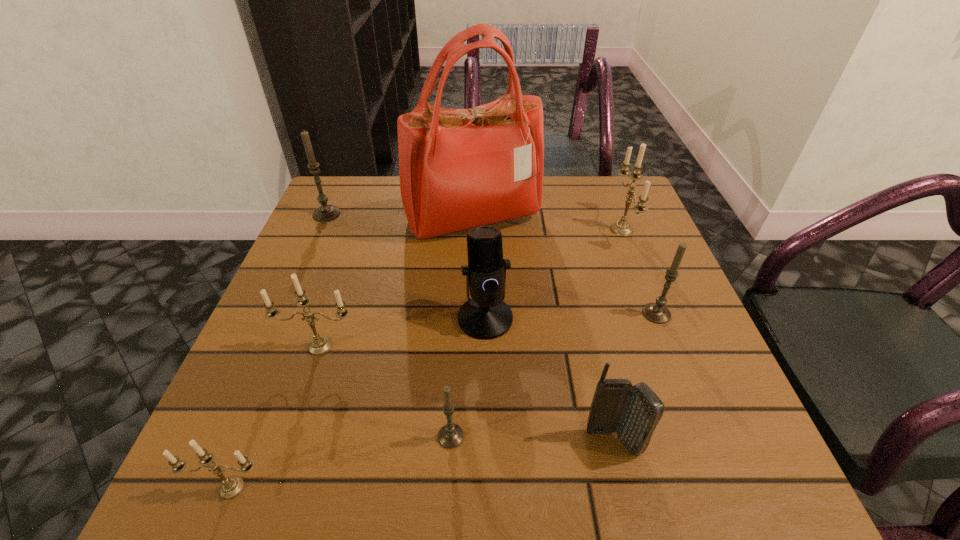
The height and width of the screenshot is (540, 960). In order to click on the second smallest metallic candle in this screenshot , I will do `click(320, 345)`.

Locate an element on the screen. the seventh object from left to right is located at coordinates (633, 412).

I want to click on the smallest gray candle, so click(x=450, y=436).

At what (x,y) coordinates should I click in order to perform the action: click on the nearest gray candle. Please return your answer as a coordinate pair (x, y). The height and width of the screenshot is (540, 960). Looking at the image, I should click on (450, 436).

Locate an element on the screen. Image resolution: width=960 pixels, height=540 pixels. the nearest object is located at coordinates (231, 487).

Find the location of a particular element. The image size is (960, 540). the nearest candle is located at coordinates (231, 487).

At what (x,y) coordinates should I click in order to perform the action: click on vacant region located on the front-facing side of the tallest object. Please return your answer as a coordinate pair (x, y). This screenshot has height=540, width=960. Looking at the image, I should click on (470, 369).

Identify the location of free space located 0.200m on the front of the biggest metallic candle. (656, 319).

Where is `free space located 0.060m on the right of the farthest gray candle`? This screenshot has width=960, height=540. free space located 0.060m on the right of the farthest gray candle is located at coordinates (364, 214).

The image size is (960, 540). Identify the location of vacant space located 0.280m on the stand of the black microphone. (488, 495).